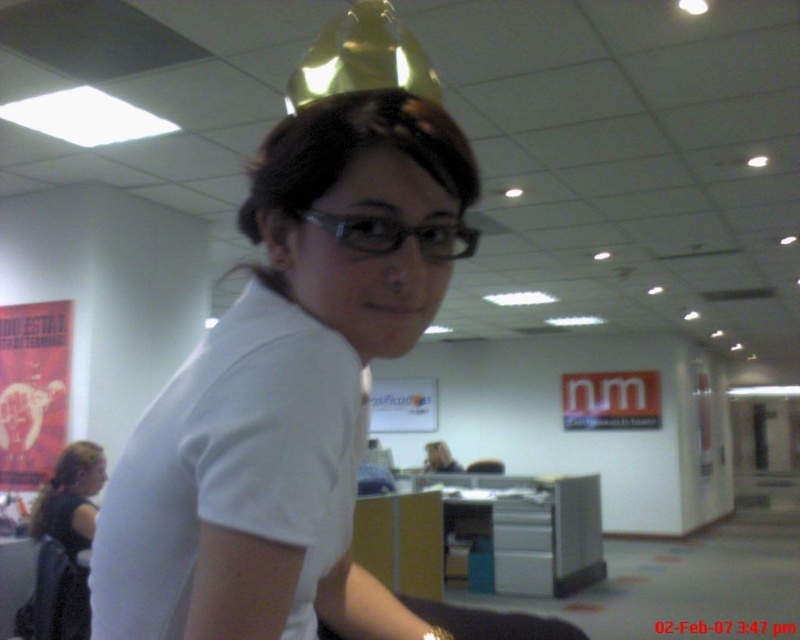
You are standing in the office described. You need to place a small plant on the desk at point (396, 234). Is there enough space for it?

The point (396, 234) has transparent plastic glasses at center, so placing a small plant there may not be possible due to the glasses occupying the space.

You are a photographer trying to capture a clear shot of the transparent plastic glasses at center and the blonde hair at lower left. Since the glasses are in front of the blonde hair, will the glasses block the view of the hair in the photo?

Yes, the transparent plastic glasses at center will block the view of the blonde hair at lower left because they are positioned in front of it.